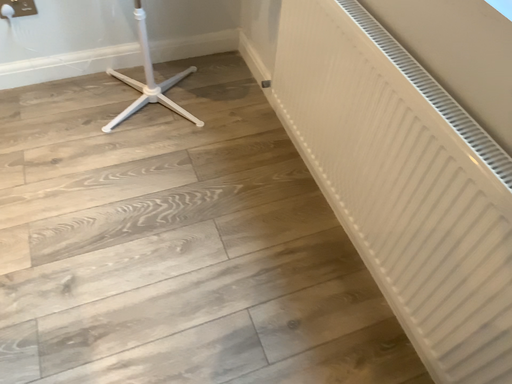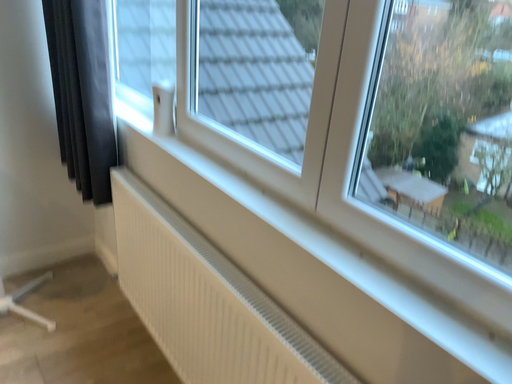
Question: Which way did the camera rotate in the video?

Choices:
 (A) rotated downward
 (B) rotated upward

Answer: (B)